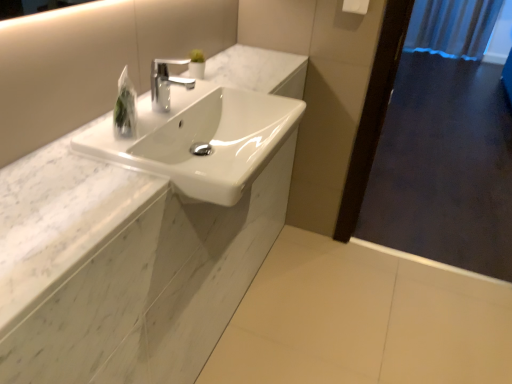
Image resolution: width=512 pixels, height=384 pixels. Find the location of `empty space that is ontop of white marble counter at center (from a real-world perspective)`. empty space that is ontop of white marble counter at center (from a real-world perspective) is located at coordinates (104, 151).